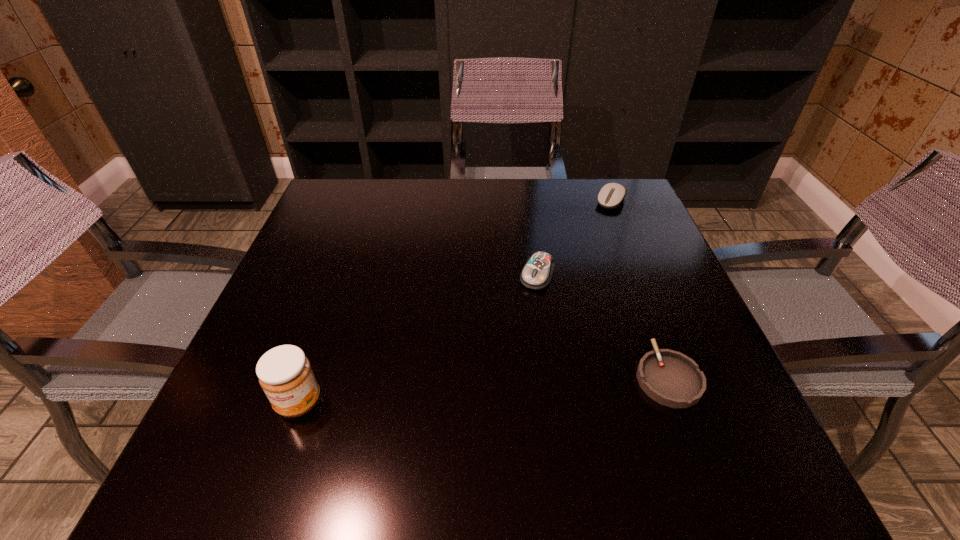
Where is `free space on the desktop that is between the jam and the shortest object and is positioned on the wheel side of the farthest object`? This screenshot has height=540, width=960. free space on the desktop that is between the jam and the shortest object and is positioned on the wheel side of the farthest object is located at coordinates (464, 390).

Identify the location of free space on the desktop that is between the tallest object and the ashtray and is positioned on the wheel side of the left computer mouse. (481, 389).